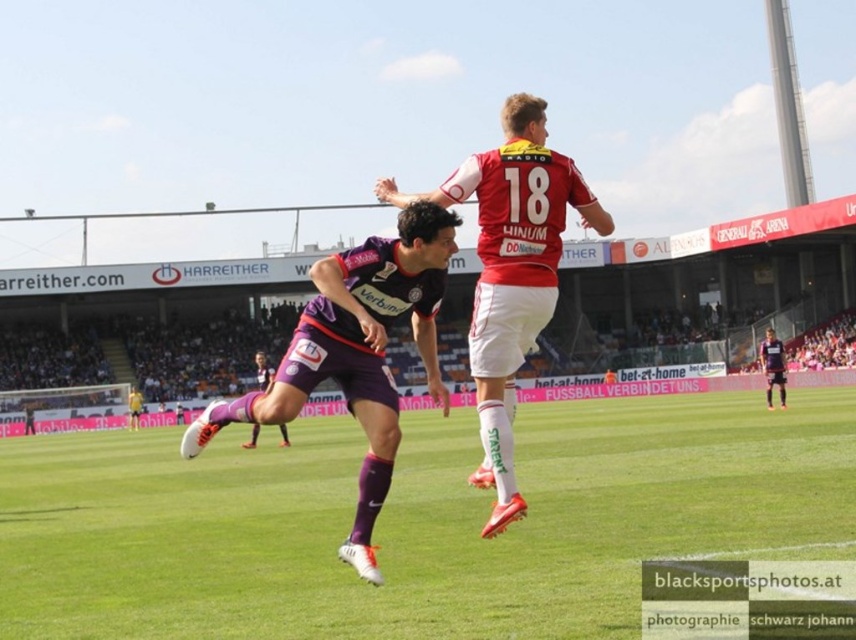
Which is behind, point (19, 477) or point (768, 392)?

The point (768, 392) is more distant.

Can you confirm if green grass at center is positioned to the left of dark purple jersey at center?

Correct, you'll find green grass at center to the left of dark purple jersey at center.

Locate an element on the screen. green grass at center is located at coordinates (414, 522).

I want to click on green grass at center, so click(x=414, y=522).

Which is above, green grass at center or purple matte jersey at center?

purple matte jersey at center

Measure the distance between green grass at center and camera.

green grass at center is 9.24 meters from camera.

Image resolution: width=856 pixels, height=640 pixels. I want to click on green grass at center, so click(x=414, y=522).

Does red jersey at center appear under purple matte shorts at lower center?

No, red jersey at center is not below purple matte shorts at lower center.

Describe the element at coordinates (510, 272) in the screenshot. This screenshot has width=856, height=640. I see `red jersey at center` at that location.

At what (x,y) coordinates should I click in order to perform the action: click on red jersey at center. Please return your answer as a coordinate pair (x, y). This screenshot has width=856, height=640. Looking at the image, I should click on (510, 272).